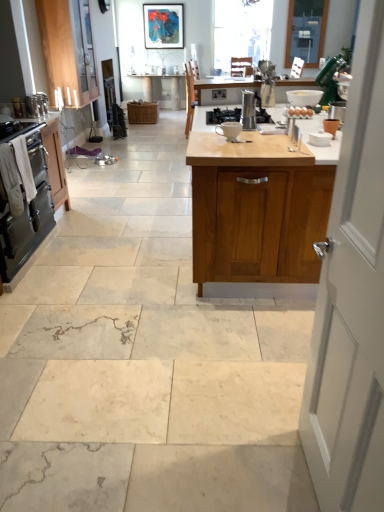
Question: Considering the relative sizes of matte black picture frame at upper center and brown matte eggs at center in the image provided, is matte black picture frame at upper center taller than brown matte eggs at center?

Choices:
 (A) no
 (B) yes

Answer: (B)

Question: Is matte black picture frame at upper center to the right of brown matte eggs at center from the viewer's perspective?

Choices:
 (A) no
 (B) yes

Answer: (A)

Question: Is brown matte eggs at center a part of matte black picture frame at upper center?

Choices:
 (A) no
 (B) yes

Answer: (A)

Question: From a real-world perspective, is matte black picture frame at upper center over brown matte eggs at center?

Choices:
 (A) yes
 (B) no

Answer: (A)

Question: Is the surface of matte black picture frame at upper center in direct contact with brown matte eggs at center?

Choices:
 (A) no
 (B) yes

Answer: (A)

Question: Is matte black picture frame at upper center shorter than brown matte eggs at center?

Choices:
 (A) no
 (B) yes

Answer: (A)

Question: Would you say satin silver cabinet at center is outside white ceramic mug at center, the first appliance in the front-to-back sequence?

Choices:
 (A) no
 (B) yes

Answer: (B)

Question: Is satin silver cabinet at center taller than white ceramic mug at center, the first appliance in the front-to-back sequence?

Choices:
 (A) yes
 (B) no

Answer: (A)

Question: Does satin silver cabinet at center appear on the right side of white ceramic mug at center, the fifth appliance viewed from the back?

Choices:
 (A) yes
 (B) no

Answer: (B)

Question: From a real-world perspective, is satin silver cabinet at center on white ceramic mug at center, the first appliance in the front-to-back sequence?

Choices:
 (A) no
 (B) yes

Answer: (A)

Question: From the image's perspective, would you say satin silver cabinet at center is shown under white ceramic mug at center, the 3th appliance when ordered from right to left?

Choices:
 (A) no
 (B) yes

Answer: (A)

Question: Is the depth of satin silver cabinet at center greater than that of white ceramic mug at center, which is counted as the third appliance, starting from the left?

Choices:
 (A) yes
 (B) no

Answer: (A)

Question: Considering the relative sizes of black matte gas stove at center and white towel oven at left, which is counted as the second cabinetry, starting from the right, in the image provided, is black matte gas stove at center bigger than white towel oven at left, which is counted as the second cabinetry, starting from the right,?

Choices:
 (A) no
 (B) yes

Answer: (A)